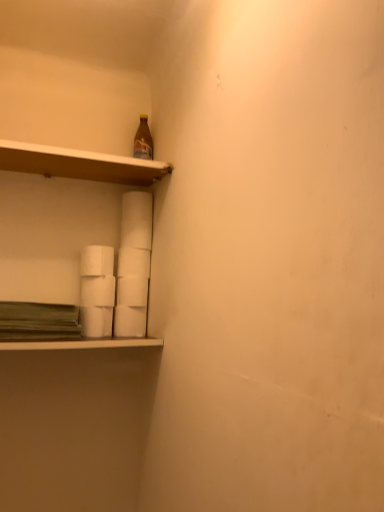
Image resolution: width=384 pixels, height=512 pixels. Identify the location of free space in front of white matte paper towel at lower left, the 2th paper towel from the bottom. (92, 340).